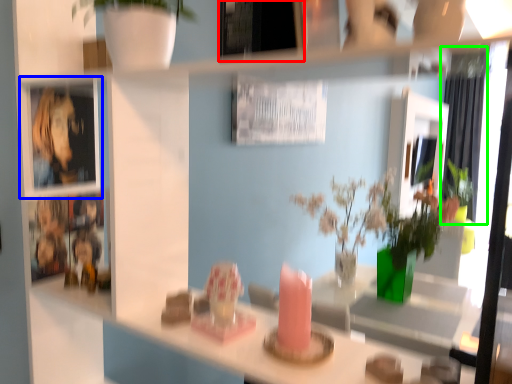
Question: Which object is the closest to the picture frame (highlighted by a red box)? Choose among these: cabinet (highlighted by a blue box) or curtain (highlighted by a green box).

Choices:
 (A) cabinet
 (B) curtain

Answer: (A)